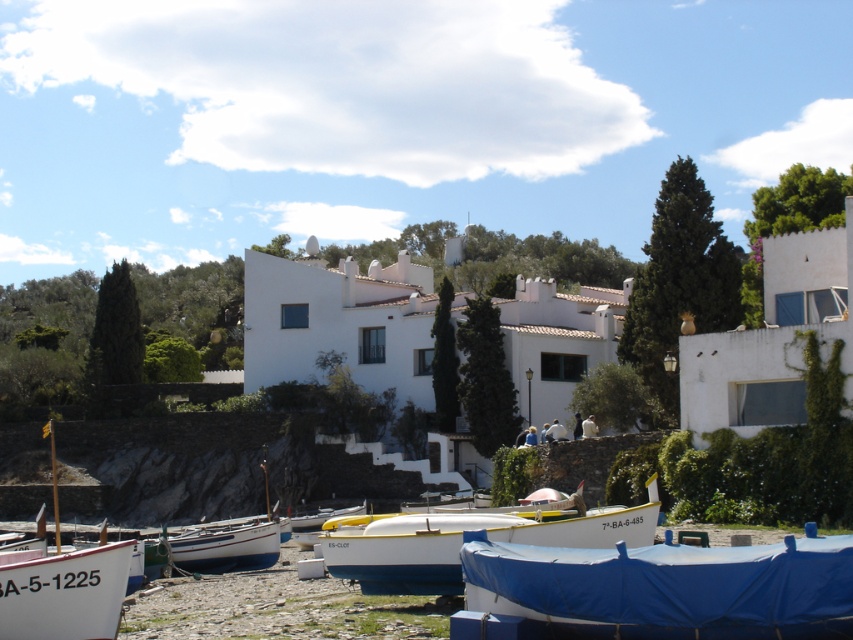
You are a photographer planning to capture a wide shot of the coastal scene. You need to ensure both the blue tarpaulin boat at lower center and the white wooden boat at lower left are fully visible in the frame. Given their sizes, which boat will appear bigger in the photograph?

The blue tarpaulin boat at lower center will appear bigger in the photograph because it has a larger size compared to the white wooden boat at lower left.